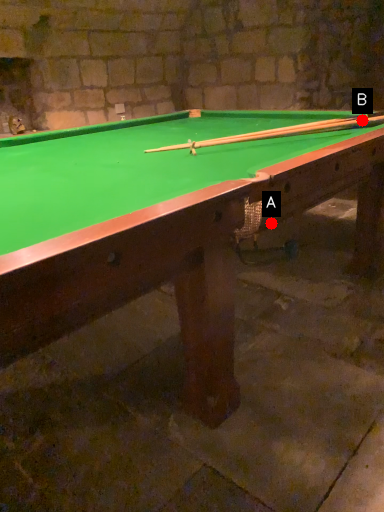
Question: Two points are circled on the image, labeled by A and B beside each circle. Which of the following is the closest to the observer?

Choices:
 (A) A is closer
 (B) B is closer

Answer: (A)